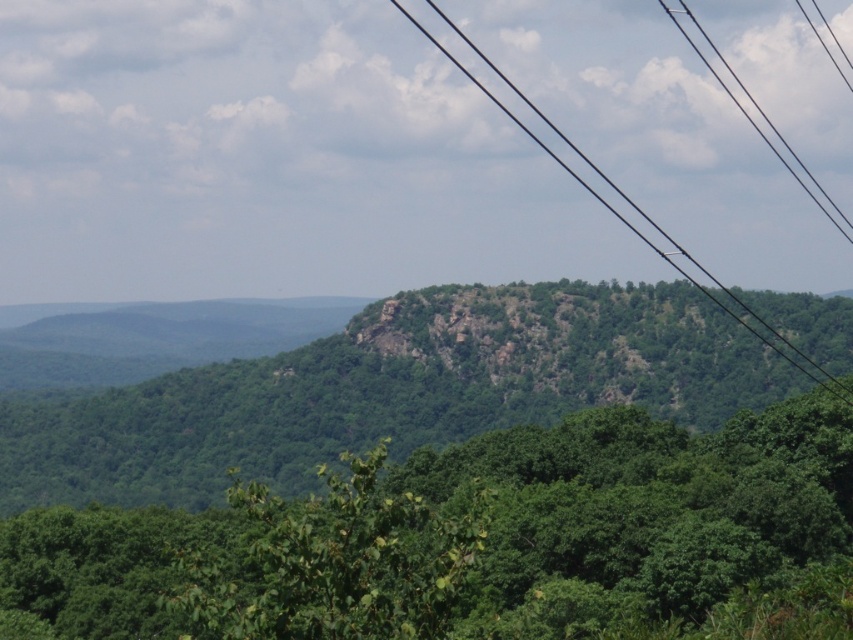
Question: Can you confirm if green leafy tree at center is thinner than green rocky mountain at center?

Choices:
 (A) yes
 (B) no

Answer: (A)

Question: Which is farther from the black wire at upper center?

Choices:
 (A) black wire at upper right
 (B) green rocky mountain at center

Answer: (B)

Question: Which point is closer to the camera?

Choices:
 (A) black wire at upper right
 (B) green rocky mountain at center
 (C) green leafy tree at center

Answer: (C)

Question: Can you confirm if green rocky mountain at center is wider than black wire at upper right?

Choices:
 (A) no
 (B) yes

Answer: (B)

Question: Observing the image, what is the correct spatial positioning of green leafy tree at center in reference to black wire at upper right?

Choices:
 (A) below
 (B) above

Answer: (A)

Question: Among these points, which one is nearest to the camera?

Choices:
 (A) (817, 508)
 (B) (136, 502)
 (C) (541, 116)
 (D) (764, 118)

Answer: (A)